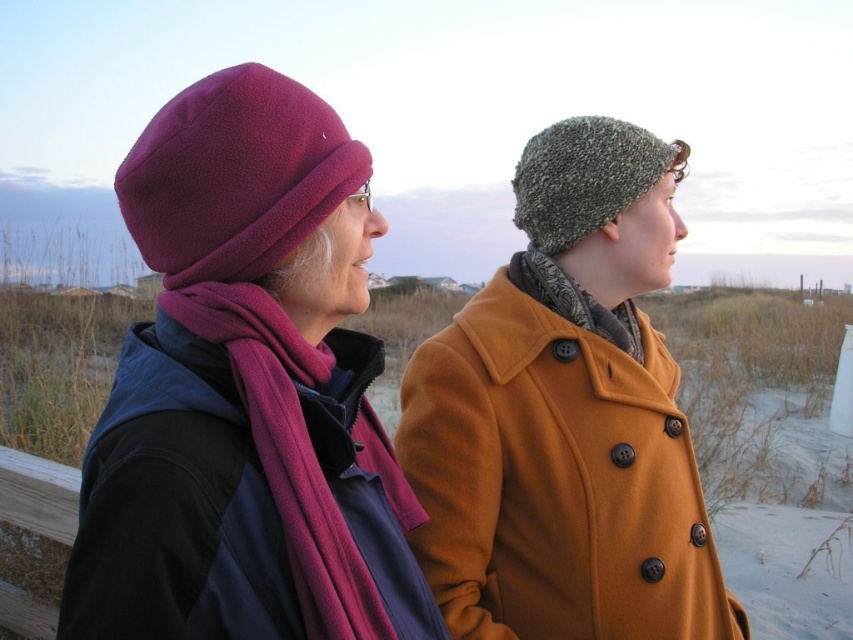
Can you confirm if mustard woolen coat at right is wider than green knitted beanie at upper right?

Correct, the width of mustard woolen coat at right exceeds that of green knitted beanie at upper right.

Who is higher up, mustard woolen coat at right or green knitted beanie at upper right?

green knitted beanie at upper right is higher up.

Where is `mustard woolen coat at right`? The width and height of the screenshot is (853, 640). mustard woolen coat at right is located at coordinates (556, 472).

Between point (216, 145) and point (289, 328), which one is positioned behind?

Positioned behind is point (289, 328).

Locate an element on the screen. fuzzy purple beanie at left is located at coordinates (234, 177).

Is point (151, 262) farther from camera compared to point (311, 548)?

Yes, point (151, 262) is farther from viewer.

Is matte purple beanie at left smaller than fuzzy pink scarf at center?

No.

Between point (241, 380) and point (376, 445), which one is positioned in front?

Point (241, 380) is more forward.

I want to click on matte purple beanie at left, so click(x=399, y=397).